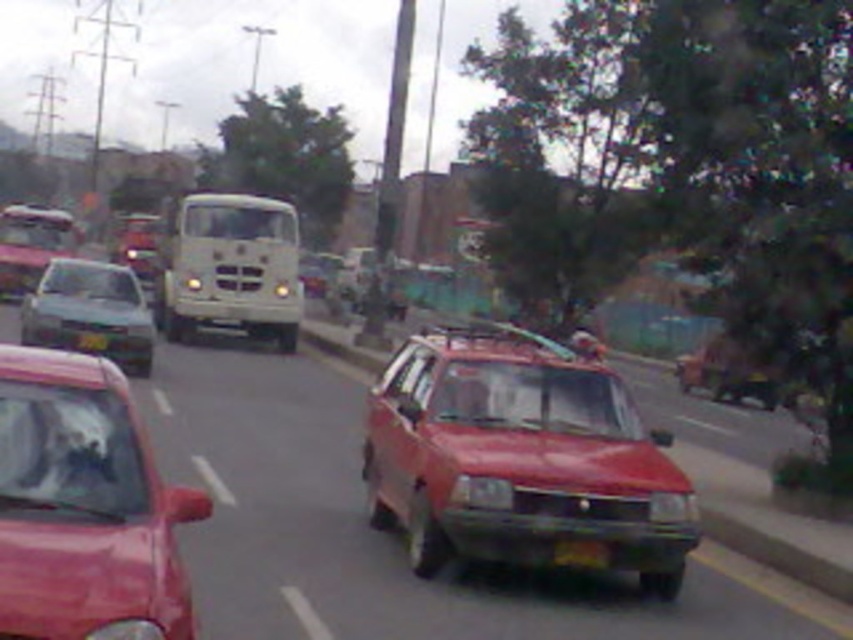
You are a pedestrian standing at the crosswalk observing the matte red car at left and the black plastic license plate at center. Which object is closer to the left side of the road?

The matte red car at left is closer to the left side of the road since it is positioned to the left of the black plastic license plate at center.

You are a pedestrian standing at the point marked by the coordinate point at (520,458). You want to cross the street to reach the other side. Is the shiny red car at center blocking your path?

The point at (520,458) is where the shiny red car at center is located, so yes, the shiny red car at center is blocking your path.